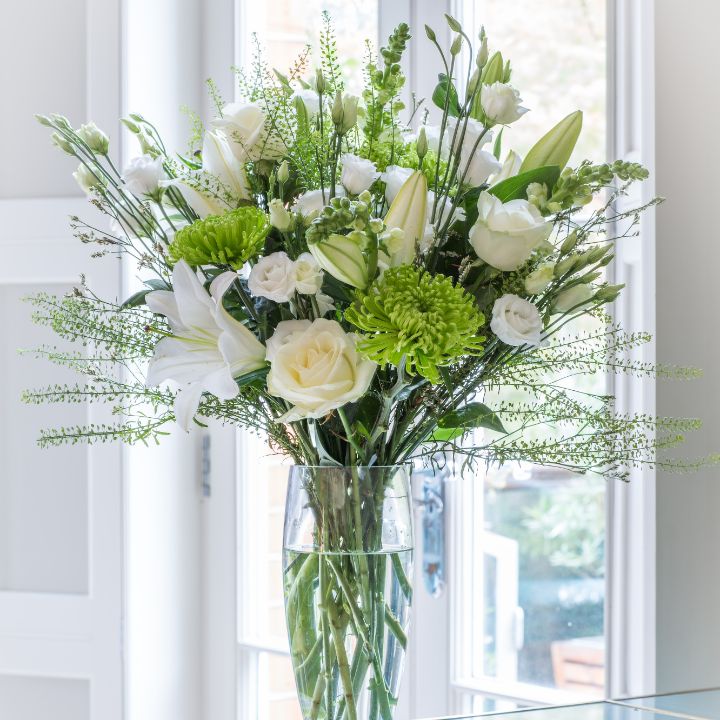
Locate an element on the screen. handle is located at coordinates (433, 502).